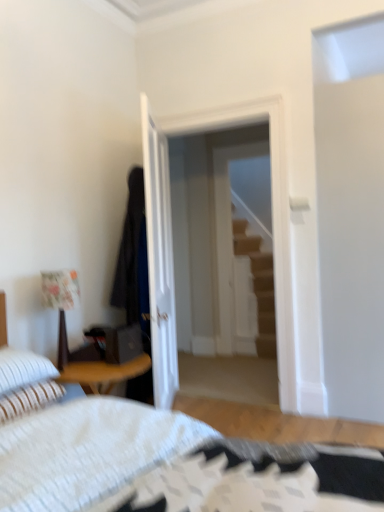
This screenshot has height=512, width=384. Identify the location of blank space to the left of wooden staircase at center. (224, 359).